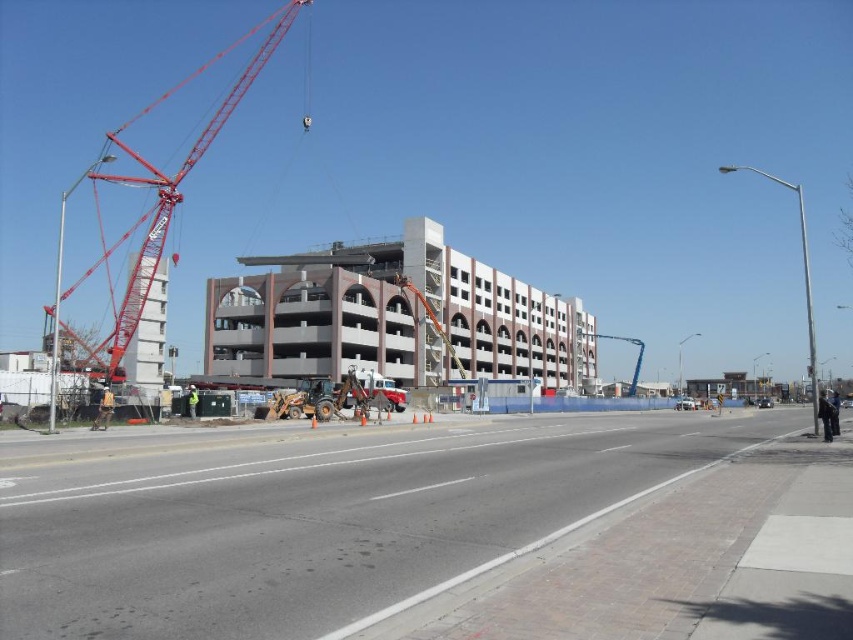
Question: Is blue concrete construction site at center below red metallic crane at left?

Choices:
 (A) yes
 (B) no

Answer: (A)

Question: Is blue concrete construction site at center wider than red metallic crane at left?

Choices:
 (A) no
 (B) yes

Answer: (A)

Question: Where is blue concrete construction site at center located in relation to red metallic crane at left in the image?

Choices:
 (A) right
 (B) left

Answer: (A)